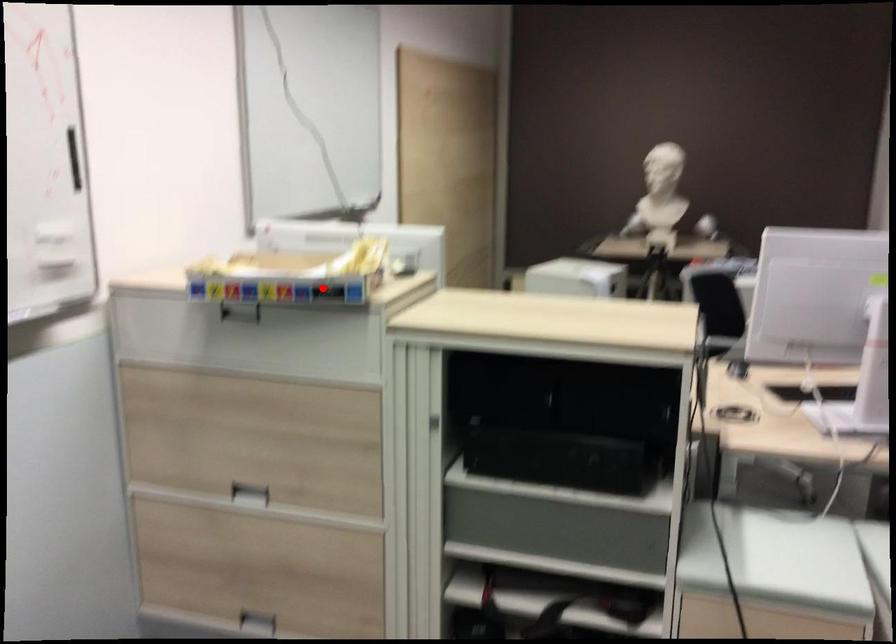
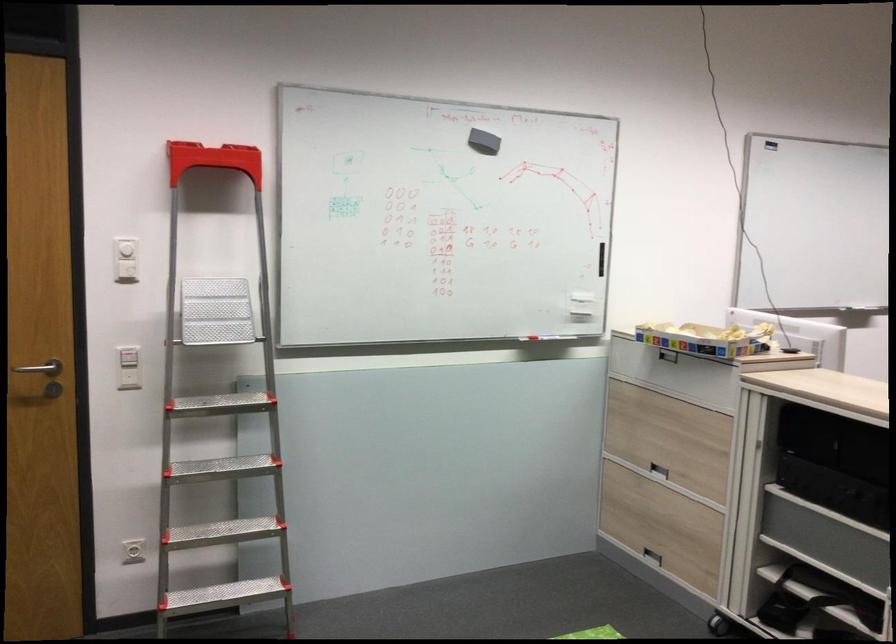
Where in the second image is the point corresponding to the highlighted location from the first image?

(705, 339)